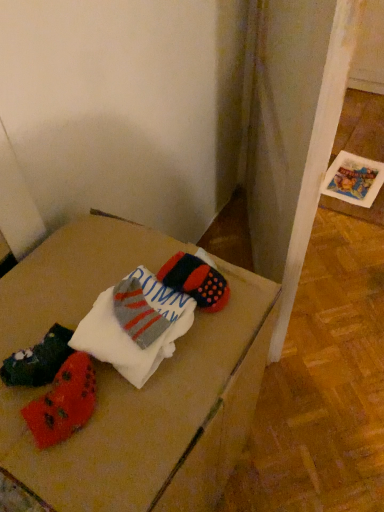
The width and height of the screenshot is (384, 512). In order to click on free location in front of white cotton socks at center in this screenshot , I will do `click(135, 438)`.